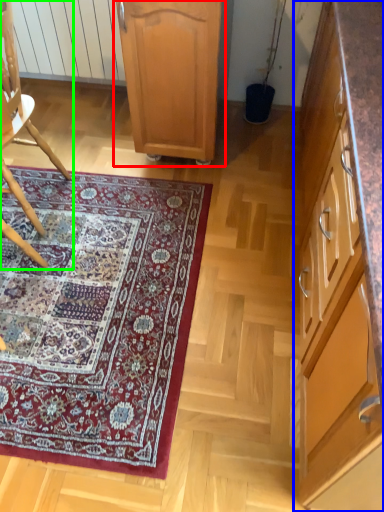
Question: Estimate the real-world distances between objects in this image. Which object is farther from cabinetry (highlighted by a red box), cabinetry (highlighted by a blue box) or chair (highlighted by a green box)?

Choices:
 (A) cabinetry
 (B) chair

Answer: (A)